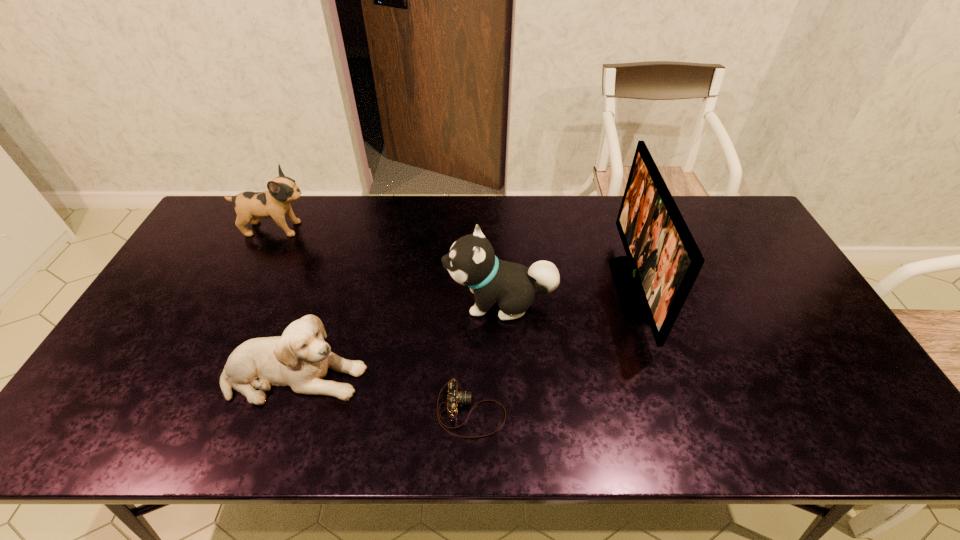
Locate an element on the screen. This screenshot has width=960, height=540. object situated at the far left corner is located at coordinates (250, 206).

This screenshot has width=960, height=540. In the image, there is a desktop. Find the location of `vacant area at the far edge`. vacant area at the far edge is located at coordinates (614, 239).

Locate an element on the screen. This screenshot has height=540, width=960. free location at the near edge of the desktop is located at coordinates (542, 436).

The height and width of the screenshot is (540, 960). I want to click on blank area at the right edge, so click(x=747, y=257).

This screenshot has width=960, height=540. What are the coordinates of `free space at the near left corner` in the screenshot? It's located at (83, 426).

This screenshot has height=540, width=960. In the image, there is a desktop. In order to click on blank space at the far right corner in this screenshot , I will do `click(746, 215)`.

Locate an element on the screen. This screenshot has height=540, width=960. free spot between the camera and the farthest puppy is located at coordinates (373, 320).

Where is `vacant space in between the camera and the rightmost object`? The height and width of the screenshot is (540, 960). vacant space in between the camera and the rightmost object is located at coordinates pyautogui.click(x=552, y=350).

At what (x,y) coordinates should I click in order to perform the action: click on free space between the second shortest object and the monitor. Please return your answer as a coordinate pair (x, y). Image resolution: width=960 pixels, height=540 pixels. Looking at the image, I should click on (464, 333).

Locate an element on the screen. blank region between the rightmost puppy and the nearest puppy is located at coordinates (397, 339).